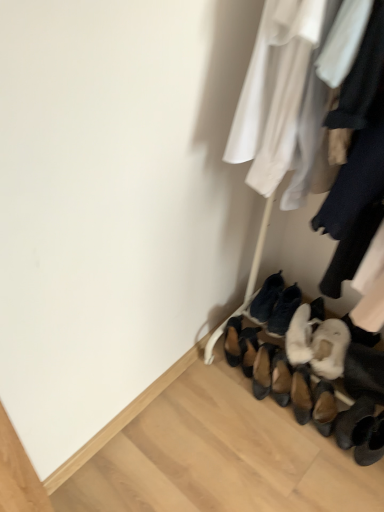
How much space does fuzzy white slippers at center, which is the 3th footwear in right-to-left order, occupy vertically?

3.74 inches.

Image resolution: width=384 pixels, height=512 pixels. I want to click on brown suede shoes at lower center, the first footwear viewed from the left, so click(233, 341).

How much space does black suede shoes at lower center, marked as the 3th footwear in a left-to-right arrangement, occupy vertically?

black suede shoes at lower center, marked as the 3th footwear in a left-to-right arrangement, is 3.74 inches in height.

Describe the element at coordinates (248, 348) in the screenshot. I see `brown suede shoes at lower center, placed as the second footwear when sorted from left to right` at that location.

The width and height of the screenshot is (384, 512). I want to click on fuzzy white slippers at center, marked as the 4th footwear in a left-to-right arrangement, so click(284, 310).

Is white fur boot at lower right, the 2th footwear viewed from the right, not within black suede shoes at lower center, marked as the 3th footwear in a left-to-right arrangement?

Yes, white fur boot at lower right, the 2th footwear viewed from the right, is located beyond the bounds of black suede shoes at lower center, marked as the 3th footwear in a left-to-right arrangement.

From the image's perspective, would you say white fur boot at lower right, the 2th footwear viewed from the right, is shown under black suede shoes at lower center, acting as the 4th footwear starting from the right?

Indeed, from the image's perspective, white fur boot at lower right, the 2th footwear viewed from the right, is shown beneath black suede shoes at lower center, acting as the 4th footwear starting from the right.

Is point (305, 315) positioned behind point (271, 305)?

No, it is not.

Is white fur boot at lower right, the 2th footwear viewed from the right, directly adjacent to black suede shoes at lower center, acting as the 4th footwear starting from the right?

white fur boot at lower right, the 2th footwear viewed from the right, and black suede shoes at lower center, acting as the 4th footwear starting from the right, are not in contact.

From the image's perspective, which object appears higher, white fur boot at lower right, the 2th footwear viewed from the right, or brown suede shoes at lower center, the first footwear viewed from the left?

From the image's view, white fur boot at lower right, the 2th footwear viewed from the right, is above.

Would you say white fur boot at lower right, the 2th footwear viewed from the right, is outside brown suede shoes at lower center, arranged as the sixth footwear when viewed from the right?

Yes.

Does white fur boot at lower right, the fifth footwear in the left-to-right sequence, have a smaller size compared to brown suede shoes at lower center, the first footwear viewed from the left?

No, white fur boot at lower right, the fifth footwear in the left-to-right sequence, is not smaller than brown suede shoes at lower center, the first footwear viewed from the left.

Between white fur boot at lower right, the fifth footwear in the left-to-right sequence, and brown suede shoes at lower center, arranged as the sixth footwear when viewed from the right, which one is positioned behind?

brown suede shoes at lower center, arranged as the sixth footwear when viewed from the right.

Considering the relative positions of fuzzy white slippers at center, marked as the 4th footwear in a left-to-right arrangement, and black suede shoes at lower center, acting as the 4th footwear starting from the right, in the image provided, is fuzzy white slippers at center, marked as the 4th footwear in a left-to-right arrangement, to the left of black suede shoes at lower center, acting as the 4th footwear starting from the right, from the viewer's perspective?

Incorrect, fuzzy white slippers at center, marked as the 4th footwear in a left-to-right arrangement, is not on the left side of black suede shoes at lower center, acting as the 4th footwear starting from the right.

From a real-world perspective, which is physically below, fuzzy white slippers at center, marked as the 4th footwear in a left-to-right arrangement, or black suede shoes at lower center, marked as the 3th footwear in a left-to-right arrangement?

black suede shoes at lower center, marked as the 3th footwear in a left-to-right arrangement.

Can you confirm if fuzzy white slippers at center, marked as the 4th footwear in a left-to-right arrangement, is wider than black suede shoes at lower center, marked as the 3th footwear in a left-to-right arrangement?

In fact, fuzzy white slippers at center, marked as the 4th footwear in a left-to-right arrangement, might be narrower than black suede shoes at lower center, marked as the 3th footwear in a left-to-right arrangement.

Is black suede shoes at lower center, acting as the 4th footwear starting from the right, at the back of fuzzy white slippers at center, marked as the 4th footwear in a left-to-right arrangement?

fuzzy white slippers at center, marked as the 4th footwear in a left-to-right arrangement, does not have its back to black suede shoes at lower center, acting as the 4th footwear starting from the right.

From the image's perspective, is brown suede shoes at lower center, placed as the second footwear when sorted from left to right, below black suede shoes at lower center, marked as the 3th footwear in a left-to-right arrangement?

Yes.

Is brown suede shoes at lower center, the fifth footwear in the right-to-left sequence, oriented towards black suede shoes at lower center, acting as the 4th footwear starting from the right?

No, brown suede shoes at lower center, the fifth footwear in the right-to-left sequence, is not turned towards black suede shoes at lower center, acting as the 4th footwear starting from the right.

Can you tell me how much brown suede shoes at lower center, the fifth footwear in the right-to-left sequence, and black suede shoes at lower center, marked as the 3th footwear in a left-to-right arrangement, differ in facing direction?

1.66 degrees.

Is black suede shoes at lower center, marked as the 3th footwear in a left-to-right arrangement, inside brown suede shoes at lower center, the fifth footwear in the right-to-left sequence?

No.

Which is nearer, [276,329] or [250,359]?

The point [276,329] is in front.

Can you confirm if fuzzy white slippers at center, marked as the 4th footwear in a left-to-right arrangement, is smaller than brown suede shoes at lower center, the fifth footwear in the right-to-left sequence?

Incorrect, fuzzy white slippers at center, marked as the 4th footwear in a left-to-right arrangement, is not smaller in size than brown suede shoes at lower center, the fifth footwear in the right-to-left sequence.

Can you see fuzzy white slippers at center, which is the 3th footwear in right-to-left order, touching brown suede shoes at lower center, the fifth footwear in the right-to-left sequence?

fuzzy white slippers at center, which is the 3th footwear in right-to-left order, and brown suede shoes at lower center, the fifth footwear in the right-to-left sequence, are clearly separated.

From a real-world perspective, is black suede shoes at lower center, marked as the 3th footwear in a left-to-right arrangement, above or below brown suede shoes at lower center, the fifth footwear in the right-to-left sequence?

From a real-world perspective, black suede shoes at lower center, marked as the 3th footwear in a left-to-right arrangement, is physically above brown suede shoes at lower center, the fifth footwear in the right-to-left sequence.

Is black suede shoes at lower center, marked as the 3th footwear in a left-to-right arrangement, spatially inside brown suede shoes at lower center, the fifth footwear in the right-to-left sequence, or outside of it?

black suede shoes at lower center, marked as the 3th footwear in a left-to-right arrangement, is outside brown suede shoes at lower center, the fifth footwear in the right-to-left sequence.

There is a brown suede shoes at lower center, the fifth footwear in the right-to-left sequence. Where is `the 5th footwear above it (from the image's perspective)`? Image resolution: width=384 pixels, height=512 pixels. the 5th footwear above it (from the image's perspective) is located at coordinates [x=267, y=298].

Is black suede shoes at lower center, acting as the 4th footwear starting from the right, facing towards brown suede shoes at lower center, the fifth footwear in the right-to-left sequence?

No, black suede shoes at lower center, acting as the 4th footwear starting from the right, does not turn towards brown suede shoes at lower center, the fifth footwear in the right-to-left sequence.

Considering the points (236, 336) and (291, 290), which point is in front, point (236, 336) or point (291, 290)?

The point (236, 336) is closer to the camera.

Would you say brown suede shoes at lower center, arranged as the sixth footwear when viewed from the right, is outside fuzzy white slippers at center, marked as the 4th footwear in a left-to-right arrangement?

Yes, brown suede shoes at lower center, arranged as the sixth footwear when viewed from the right, is located beyond the bounds of fuzzy white slippers at center, marked as the 4th footwear in a left-to-right arrangement.

Which object is further away from the camera taking this photo, brown suede shoes at lower center, arranged as the sixth footwear when viewed from the right, or fuzzy white slippers at center, marked as the 4th footwear in a left-to-right arrangement?

brown suede shoes at lower center, arranged as the sixth footwear when viewed from the right, is behind.

Which footwear is the 3rd one when counting from the right side of the brown suede shoes at lower center, arranged as the sixth footwear when viewed from the right? Please provide its 2D coordinates.

[(284, 310)]

You are a GUI agent. You are given a task and a screenshot of the screen. Output one action in this format:
    pyautogui.click(x=<x>, y=<y>)
    Task: Click on the 2nd footwear to the left of the white fur boot at lower right, the 2th footwear viewed from the right, starting your count from the anchor
    
    Given the screenshot: What is the action you would take?
    pyautogui.click(x=267, y=298)

I want to click on the 1st footwear above when counting from the brown suede shoes at lower center, the first footwear viewed from the left (from the image's perspective), so click(x=303, y=331).

Based on their spatial positions, is white fur boot at lower right, the 2th footwear viewed from the right, or brown suede shoes at lower center, arranged as the sixth footwear when viewed from the right, closer to fuzzy white slippers at center, marked as the 4th footwear in a left-to-right arrangement?

The object closer to fuzzy white slippers at center, marked as the 4th footwear in a left-to-right arrangement, is white fur boot at lower right, the 2th footwear viewed from the right.

Estimate the real-world distances between objects in this image. Which object is further from white fur boot at lower right, the 2th footwear viewed from the right, brown suede shoes at lower center, the fifth footwear in the right-to-left sequence, or black suede shoes at lower center, marked as the 3th footwear in a left-to-right arrangement?

brown suede shoes at lower center, the fifth footwear in the right-to-left sequence.

When comparing their distances from white fur boot at lower right, the 2th footwear viewed from the right, does fuzzy white slippers at center, which is the 3th footwear in right-to-left order, or brown suede shoes at lower center, arranged as the sixth footwear when viewed from the right, seem further?

brown suede shoes at lower center, arranged as the sixth footwear when viewed from the right, lies further to white fur boot at lower right, the 2th footwear viewed from the right, than the other object.

Looking at the image, which one is located closer to white fur boot at lower right, the 2th footwear viewed from the right, brown suede shoes at lower center, the fifth footwear in the right-to-left sequence, or white fluffy slippers at lower right, the 1th footwear from the right?

white fluffy slippers at lower right, the 1th footwear from the right, is positioned closer to the anchor white fur boot at lower right, the 2th footwear viewed from the right.

When comparing their distances from brown suede shoes at lower center, placed as the second footwear when sorted from left to right, does brown suede shoes at lower center, arranged as the sixth footwear when viewed from the right, or black suede shoes at lower center, acting as the 4th footwear starting from the right, seem further?

black suede shoes at lower center, acting as the 4th footwear starting from the right, is further to brown suede shoes at lower center, placed as the second footwear when sorted from left to right.

From the image, which object appears to be farther from white fur boot at lower right, the 2th footwear viewed from the right, brown suede shoes at lower center, arranged as the sixth footwear when viewed from the right, or white fluffy slippers at lower right, the 1th footwear from the right?

Among the two, brown suede shoes at lower center, arranged as the sixth footwear when viewed from the right, is located further to white fur boot at lower right, the 2th footwear viewed from the right.

Considering their positions, is white fluffy slippers at lower right, which is the 6th footwear from left to right, positioned further to fuzzy white slippers at center, which is the 3th footwear in right-to-left order, than brown suede shoes at lower center, arranged as the sixth footwear when viewed from the right?

Based on the image, brown suede shoes at lower center, arranged as the sixth footwear when viewed from the right, appears to be further to fuzzy white slippers at center, which is the 3th footwear in right-to-left order.

Estimate the real-world distances between objects in this image. Which object is further from white fluffy slippers at lower right, the 1th footwear from the right, black suede shoes at lower center, marked as the 3th footwear in a left-to-right arrangement, or brown suede shoes at lower center, placed as the second footwear when sorted from left to right?

Based on the image, brown suede shoes at lower center, placed as the second footwear when sorted from left to right, appears to be further to white fluffy slippers at lower right, the 1th footwear from the right.